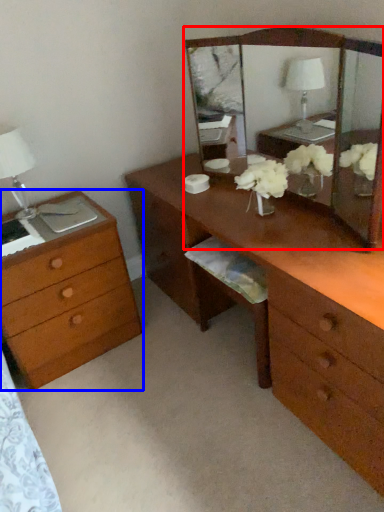
Question: Among these objects, which one is nearest to the camera, mirror (highlighted by a red box) or chest of drawers (highlighted by a blue box)?

Choices:
 (A) mirror
 (B) chest of drawers

Answer: (A)